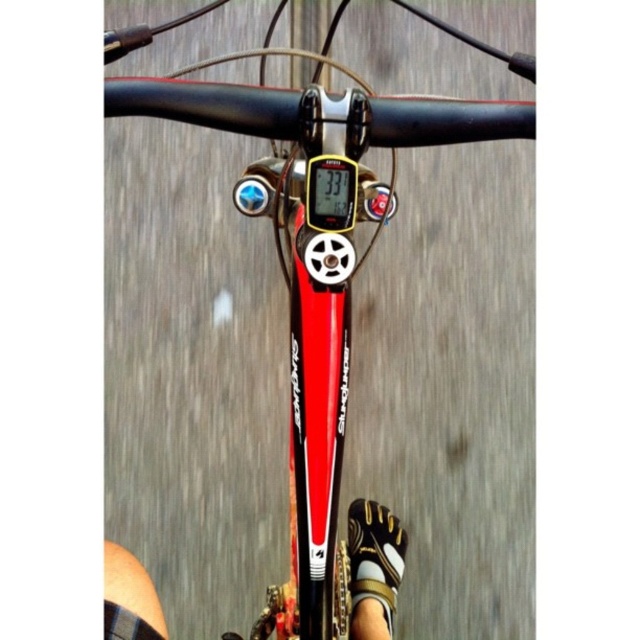
You are a photographer trying to capture a closeup of the shiny metallic bicycle at center and the white textured sandal at lower center. Since you want to focus on both objects equally, which one should you zoom in on more?

The shiny metallic bicycle at center is larger in size than the white textured sandal at lower center, so you should zoom in more on the white textured sandal at lower center to balance their sizes in the photo.

You are a cyclist checking your gear before a ride. You notice two items at the lower center of your view. What is the spatial relationship between the white textured shoe at lower center and the white textured sandal at lower center?

The white textured shoe at lower center is positioned over the white textured sandal at lower center.

You are riding a bike and looking at the handlebars. There are two points marked on the handlebars at coordinates point (304, 208) and point (364, 548). Which point is closer to you?

Point (304, 208) is closer to the viewer than point (364, 548).